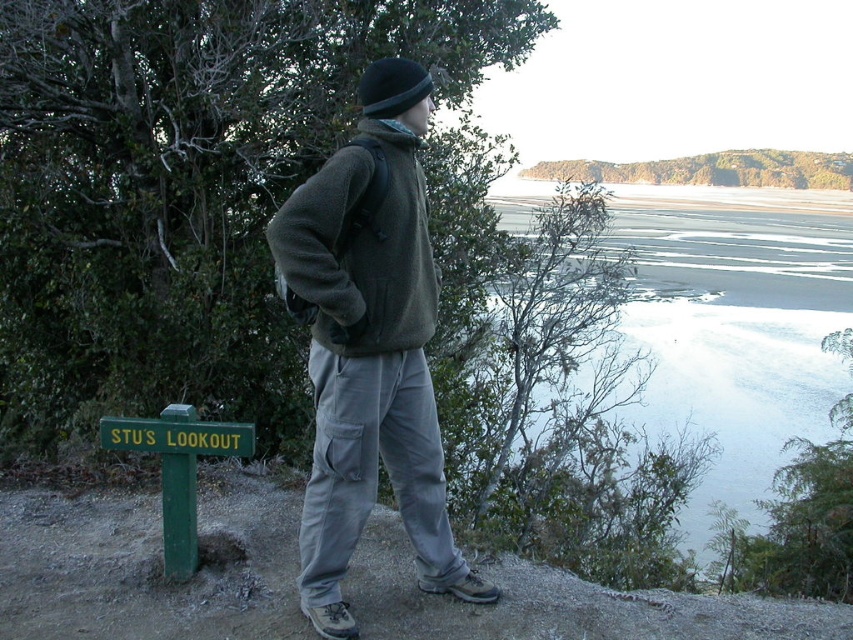
Which of these two, fuzzy green jacket at center or black woolen hat at center, stands taller?

fuzzy green jacket at center is taller.

Who is lower down, fuzzy green jacket at center or black woolen hat at center?

fuzzy green jacket at center is below.

The height and width of the screenshot is (640, 853). Describe the element at coordinates (361, 248) in the screenshot. I see `fuzzy green jacket at center` at that location.

Find the location of a particular element. The height and width of the screenshot is (640, 853). fuzzy green jacket at center is located at coordinates pyautogui.click(x=361, y=248).

Can you confirm if clear water at lower right is shorter than green painted wood sign at lower left?

Incorrect, clear water at lower right's height does not fall short of green painted wood sign at lower left's.

Is clear water at lower right above green painted wood sign at lower left?

Yes.

Is point (596, 435) in front of point (183, 508)?

That is False.

Find the location of a particular element. This screenshot has height=640, width=853. clear water at lower right is located at coordinates (662, 396).

Is fuzzy green jacket at center smaller than green painted wood sign at lower left?

Actually, fuzzy green jacket at center might be larger than green painted wood sign at lower left.

The image size is (853, 640). In order to click on fuzzy green jacket at center in this screenshot , I will do `click(361, 248)`.

This screenshot has height=640, width=853. Find the location of `fuzzy green jacket at center`. fuzzy green jacket at center is located at coordinates (361, 248).